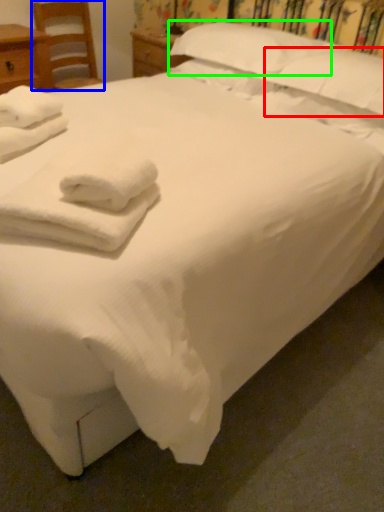
Question: Based on their relative distances, which object is farther from pillow (highlighted by a red box)? Choose from chair (highlighted by a blue box) and pillow (highlighted by a green box).

Choices:
 (A) chair
 (B) pillow

Answer: (A)